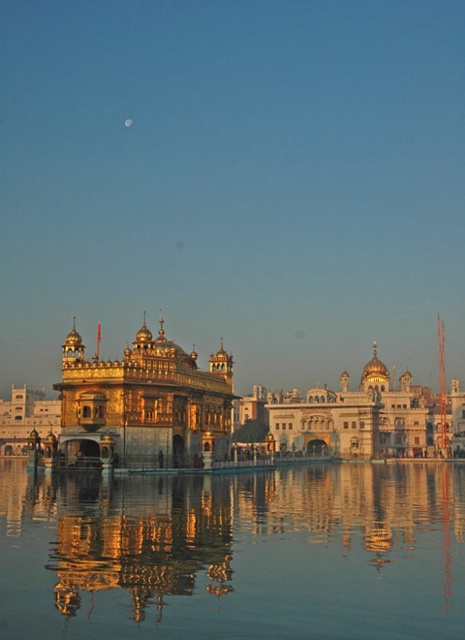
Between transparent glass water at center and gold reflective water at center, which one is positioned lower?

transparent glass water at center is below.

This screenshot has width=465, height=640. What do you see at coordinates (234, 554) in the screenshot?
I see `transparent glass water at center` at bounding box center [234, 554].

Image resolution: width=465 pixels, height=640 pixels. Find the location of `transparent glass water at center`. transparent glass water at center is located at coordinates 234,554.

Can you confirm if golden polished temple at center is taller than silvery reflective moon at upper center?

Yes, golden polished temple at center is taller than silvery reflective moon at upper center.

Is golden polished temple at center bigger than silvery reflective moon at upper center?

Indeed, golden polished temple at center has a larger size compared to silvery reflective moon at upper center.

Is point (106, 390) closer to viewer compared to point (124, 124)?

Yes, it is in front of point (124, 124).

Locate an element on the screen. Image resolution: width=465 pixels, height=640 pixels. golden polished temple at center is located at coordinates (145, 403).

Who is lower down, gold reflective water at center or silvery reflective moon at upper center?

gold reflective water at center is below.

Is point (170, 557) in front of point (132, 122)?

Yes, point (170, 557) is in front of point (132, 122).

Where is `gold reflective water at center`? gold reflective water at center is located at coordinates (145, 545).